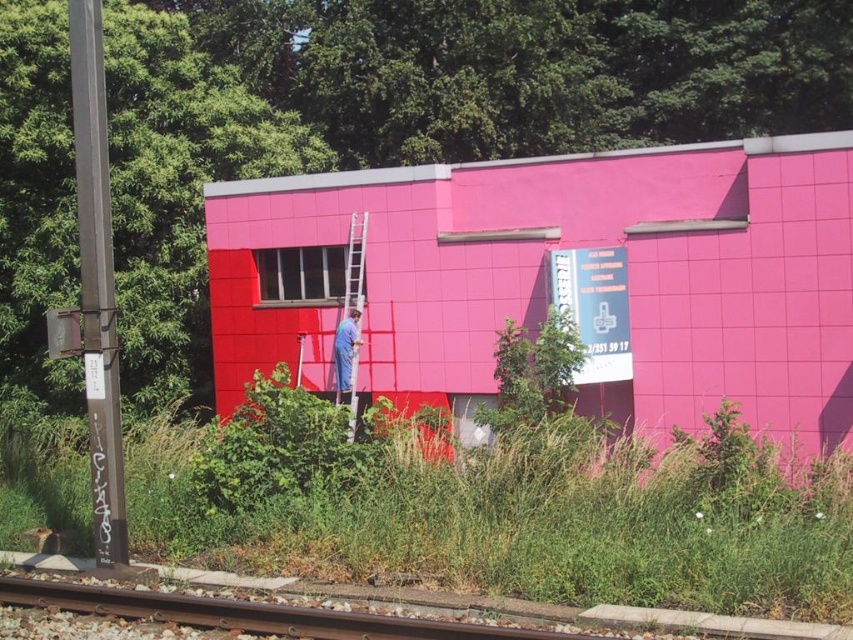
Question: Considering the relative positions of metallic silver ladder at center and blue fabric man at center in the image provided, where is metallic silver ladder at center located with respect to blue fabric man at center?

Choices:
 (A) above
 (B) below

Answer: (A)

Question: Which of the following is the closest to the observer?

Choices:
 (A) blue fabric man at center
 (B) metallic silver ladder at center
 (C) metallic pole at left

Answer: (C)

Question: Is metallic pole at left to the right of metallic silver ladder at center from the viewer's perspective?

Choices:
 (A) yes
 (B) no

Answer: (B)

Question: Is the position of metallic pole at left less distant than that of blue fabric man at center?

Choices:
 (A) yes
 (B) no

Answer: (A)

Question: Among these objects, which one is farthest from the camera?

Choices:
 (A) blue fabric man at center
 (B) metallic pole at left
 (C) metallic silver ladder at center

Answer: (C)

Question: Which object is the farthest from the blue fabric man at center?

Choices:
 (A) metallic silver ladder at center
 (B) metallic pole at left

Answer: (B)